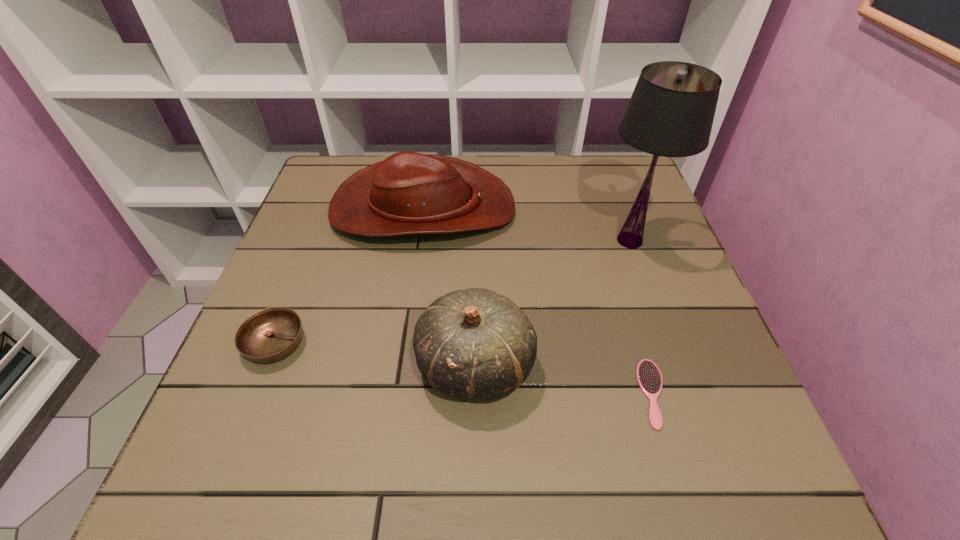
Identify the location of free space at the left edge. This screenshot has height=540, width=960. (306, 268).

In the image, there is a desktop. Identify the location of free space at the right edge. (659, 262).

Identify the location of vacant space at the far left corner of the desktop. (316, 204).

The height and width of the screenshot is (540, 960). What are the coordinates of `free space at the far right corner of the desktop` in the screenshot? It's located at (642, 182).

At what (x,y) coordinates should I click in order to perform the action: click on free space between the lampshade and the cowboy hat. Please return your answer as a coordinate pair (x, y). The width and height of the screenshot is (960, 540). Looking at the image, I should click on (527, 225).

I want to click on free area in between the shortest object and the third tallest object, so click(x=539, y=301).

Locate an element on the screen. The image size is (960, 540). empty space that is in between the lampshade and the second tallest object is located at coordinates (552, 302).

You are a GUI agent. You are given a task and a screenshot of the screen. Output one action in this format:
    pyautogui.click(x=<x>, y=<y>)
    Task: Click on the free spot between the gourd and the second shortest object
    The height and width of the screenshot is (540, 960).
    Given the screenshot: What is the action you would take?
    pyautogui.click(x=375, y=354)

Identify the location of free point between the gourd and the third shortest object. The width and height of the screenshot is (960, 540). (449, 287).

Image resolution: width=960 pixels, height=540 pixels. I want to click on free space between the soup bowl and the gourd, so click(x=375, y=354).